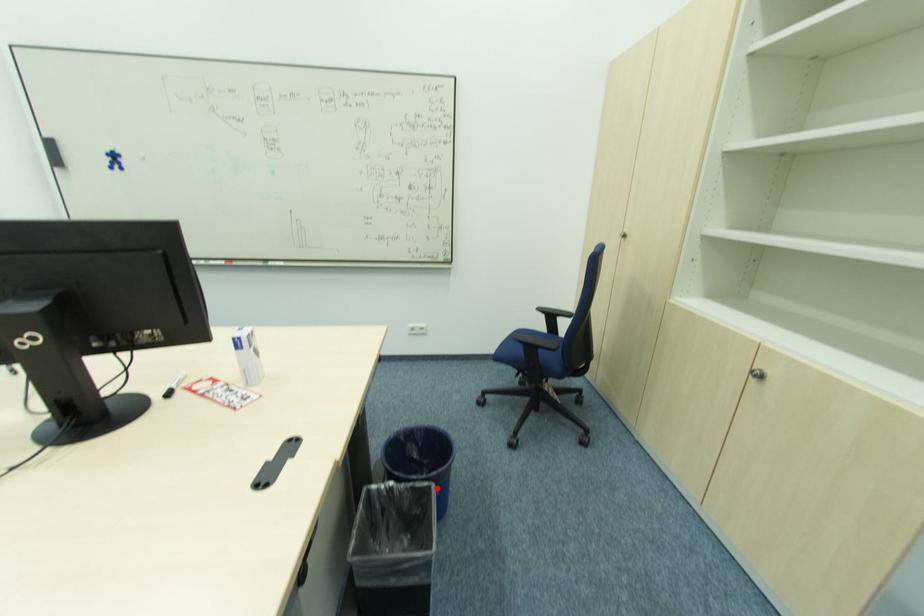
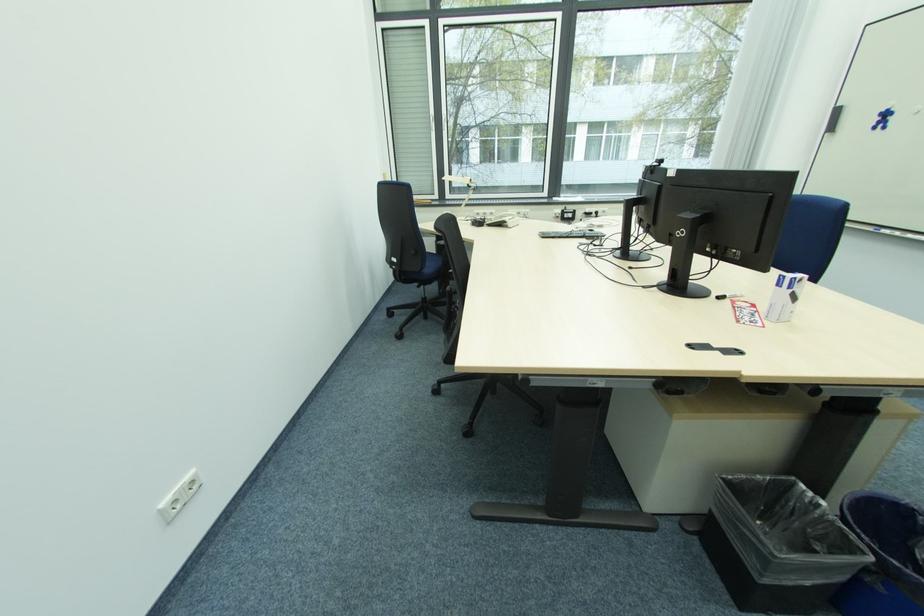
Question: I am providing you with two images of the same scene from different viewpoints. Given a red point in image1, look at the same physical point in image2. Is it:

Choices:
 (A) Closer to the viewpoint
 (B) Farther from the viewpoint

Answer: (A)